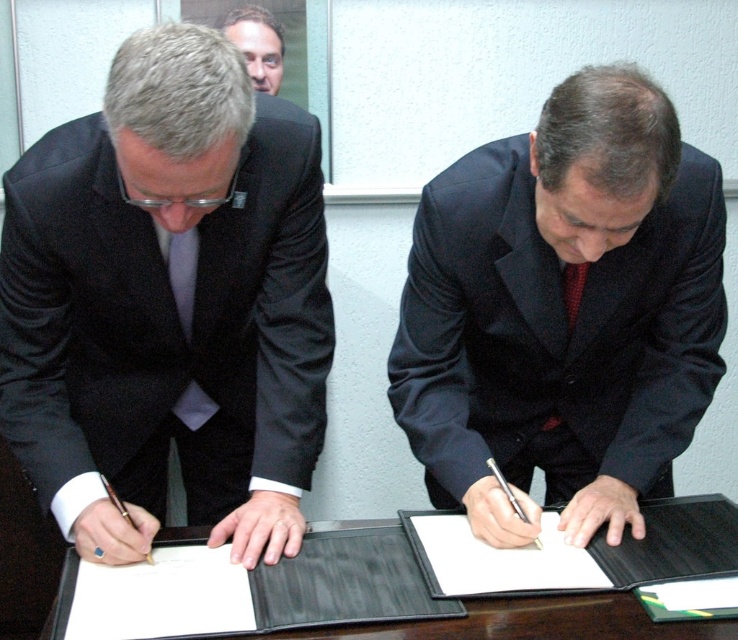
Question: Which object is closer to the camera taking this photo?

Choices:
 (A) red dotted tie at center
 (B) matte black suit at left
 (C) black leather clipboard at center

Answer: (B)

Question: Observing the image, what is the correct spatial positioning of matte black suit at left in reference to black leather table at center?

Choices:
 (A) below
 (B) above

Answer: (B)

Question: Which point is closer to the camera?

Choices:
 (A) black leather clipboard at center
 (B) red dotted tie at center

Answer: (A)

Question: Based on their relative distances, which object is nearer to the red dotted tie at center?

Choices:
 (A) matte black suit at left
 (B) black leather table at center

Answer: (B)

Question: Does matte black suit at left have a greater width compared to dark blue suit at center?

Choices:
 (A) yes
 (B) no

Answer: (B)

Question: Where is matte black suit at upper center located in relation to red dotted tie at center in the image?

Choices:
 (A) right
 (B) left

Answer: (B)